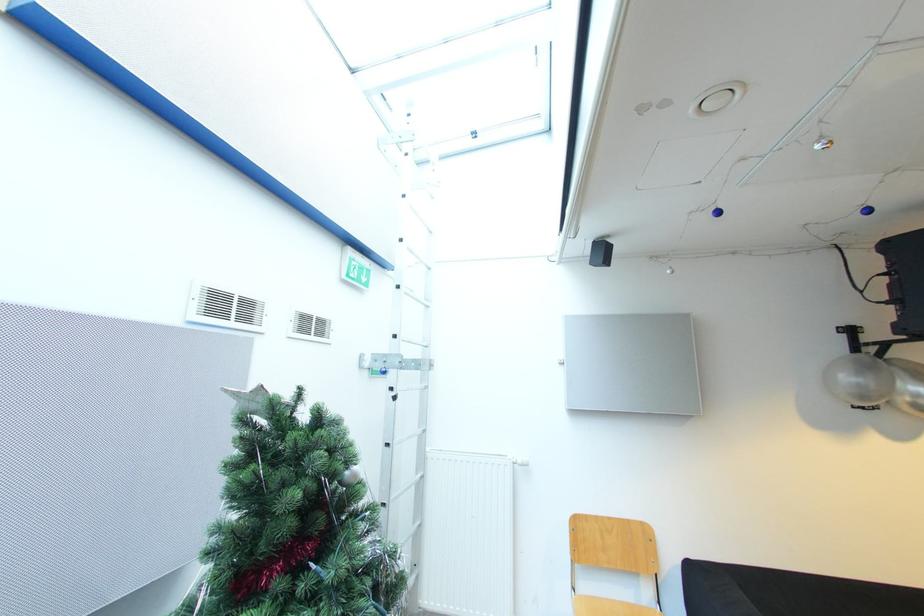
The image size is (924, 616). What do you see at coordinates (395, 147) in the screenshot? I see `a skylight latch handle` at bounding box center [395, 147].